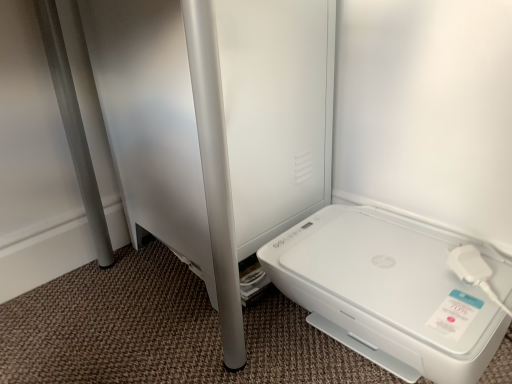
What are the coordinates of `white plastic printer at lower right` in the screenshot? It's located at pyautogui.click(x=387, y=292).

Describe the element at coordinates (387, 292) in the screenshot. This screenshot has width=512, height=384. I see `white plastic printer at lower right` at that location.

What is the approximate height of white plastic printer at lower right?

It is 7.94 inches.

You are a GUI agent. You are given a task and a screenshot of the screen. Output one action in this format:
    pyautogui.click(x=<x>, y=<y>)
    Task: Click on the white plastic printer at lower right
    
    Given the screenshot: What is the action you would take?
    pyautogui.click(x=387, y=292)